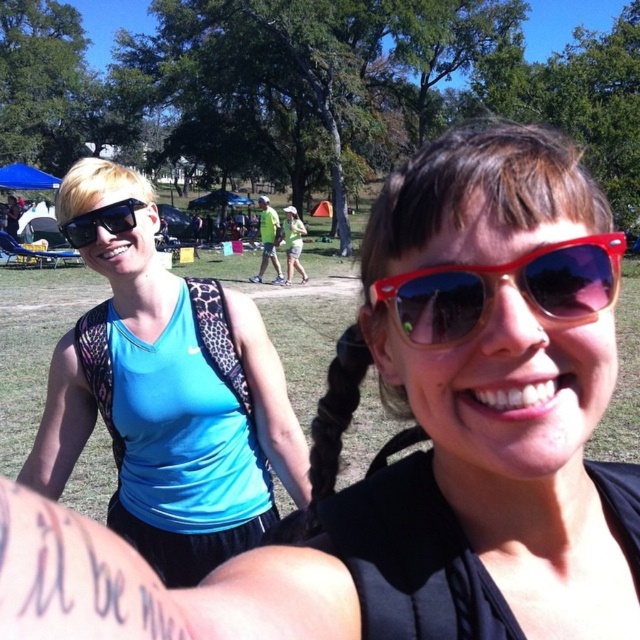
Question: Is blue leopard print tank top at left to the right of matte black sunglasses at left from the viewer's perspective?

Choices:
 (A) no
 (B) yes

Answer: (A)

Question: Which object appears closest to the camera in this image?

Choices:
 (A) red plastic sunglasses at center
 (B) blue leopard print tank top at left
 (C) matte black sunglasses at left

Answer: (A)

Question: Does blue leopard print tank top at left have a larger size compared to red plastic sunglasses at center?

Choices:
 (A) no
 (B) yes

Answer: (B)

Question: Estimate the real-world distances between objects in this image. Which object is closer to the matte black sunglasses at left?

Choices:
 (A) blue leopard print tank top at left
 (B) red plastic sunglasses at center

Answer: (A)

Question: Can you confirm if blue leopard print tank top at left is positioned to the left of matte black sunglasses at left?

Choices:
 (A) yes
 (B) no

Answer: (A)

Question: Which point is closer to the camera taking this photo?

Choices:
 (A) (134, 202)
 (B) (129, 310)

Answer: (A)